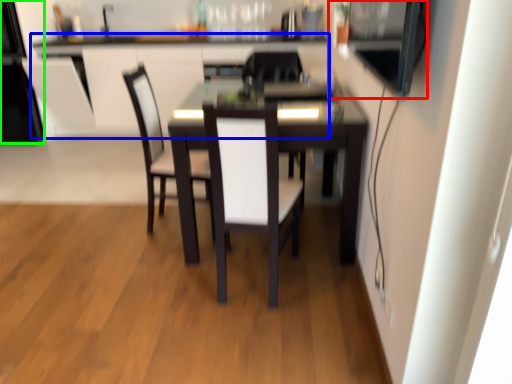
Question: Estimate the real-world distances between objects in this image. Which object is closer to appliance (highlighted by a red box), computer desk (highlighted by a blue box) or appliance (highlighted by a green box)?

Choices:
 (A) computer desk
 (B) appliance

Answer: (A)